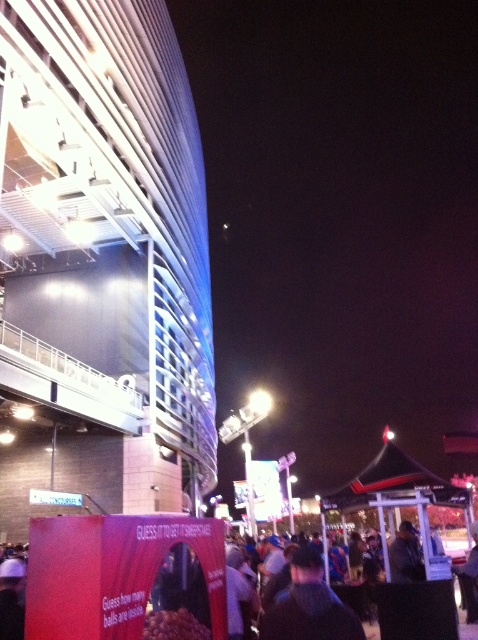
Question: Which object is farther from the camera taking this photo?

Choices:
 (A) shiny metallic balls at center
 (B) black matte canopy at center
 (C) dark blue fabric jacket at center

Answer: (B)

Question: Can you confirm if black matte canopy at center is positioned above dark brown leather jacket at center?

Choices:
 (A) no
 (B) yes

Answer: (A)

Question: Can you confirm if shiny metallic balls at center is positioned above dark brown leather jacket at center?

Choices:
 (A) no
 (B) yes

Answer: (B)

Question: Which point is farther to the camera?

Choices:
 (A) (393, 579)
 (B) (209, 637)

Answer: (A)

Question: Which object is the closest to the dark blue fabric jacket at center?

Choices:
 (A) black matte canopy at center
 (B) shiny metallic balls at center

Answer: (B)

Question: Is dark blue fabric jacket at center further to the viewer compared to black matte canopy at center?

Choices:
 (A) yes
 (B) no

Answer: (B)